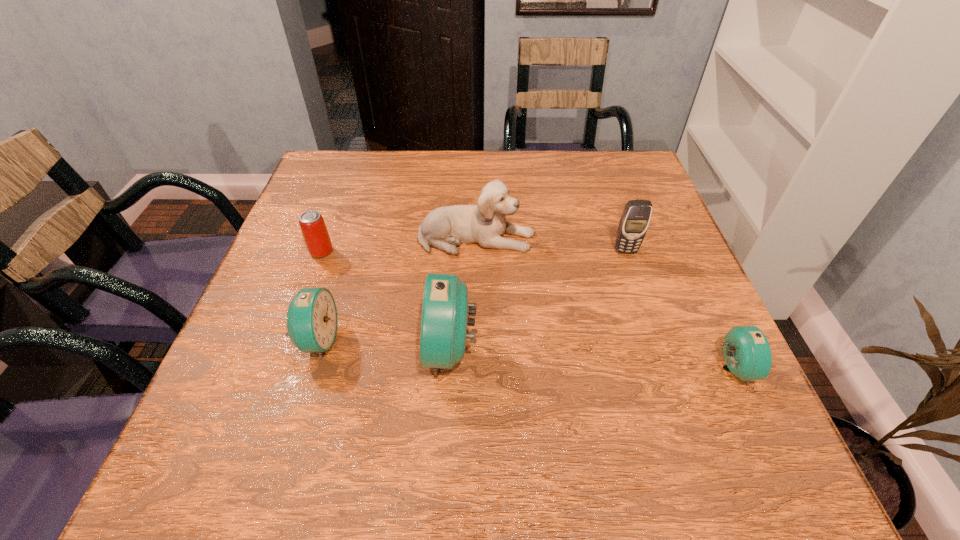
Locate an element on the screen. vacant space located on the front-facing side of the tallest object is located at coordinates (354, 349).

The height and width of the screenshot is (540, 960). I want to click on vacant space positioned 0.230m on the front-facing side of the tallest object, so click(x=300, y=349).

Locate an element on the screen. vacant space located 0.050m on the front face of the cellular telephone is located at coordinates (633, 271).

Where is `vacant space located on the front-facing side of the puppy`? This screenshot has height=540, width=960. vacant space located on the front-facing side of the puppy is located at coordinates (557, 238).

Find the location of a particular element. vacant space situated on the right of the beer can is located at coordinates (457, 252).

Identify the location of alarm clock present at the left edge. The height and width of the screenshot is (540, 960). (312, 314).

This screenshot has height=540, width=960. I want to click on beer can positioned at the left edge, so 315,233.

You are a GUI agent. You are given a task and a screenshot of the screen. Output one action in this format:
    pyautogui.click(x=<x>, y=<y>)
    Task: Click on the alarm clock located at the right edge
    The image size is (960, 540).
    Given the screenshot: What is the action you would take?
    pyautogui.click(x=747, y=354)

The image size is (960, 540). I want to click on cellular telephone present at the right edge, so click(635, 219).

You are a GUI agent. You are given a task and a screenshot of the screen. Output one action in this format:
    pyautogui.click(x=<x>, y=<y>)
    Task: Click on the object that is positioned at the near right corner
    This screenshot has height=540, width=960.
    Given the screenshot: What is the action you would take?
    pyautogui.click(x=747, y=354)